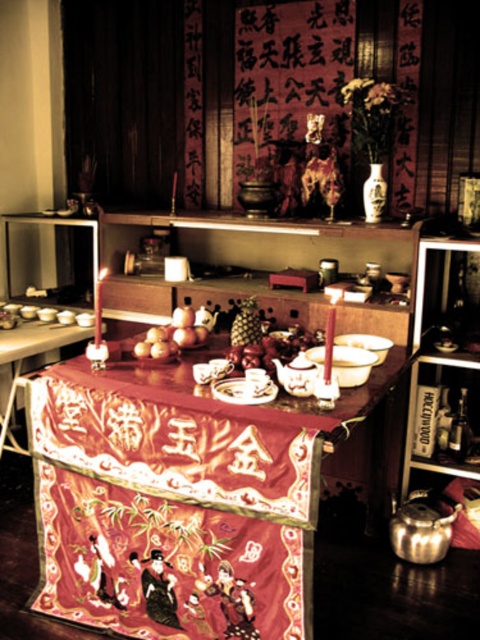
Does silky red tablecloth at center have a greater width compared to smooth golden apples at center?

Yes, silky red tablecloth at center is wider than smooth golden apples at center.

Is silky red tablecloth at center closer to the viewer compared to smooth golden apples at center?

Yes, it is in front of smooth golden apples at center.

Does point (149, 529) come behind point (186, 312)?

No, (149, 529) is in front of (186, 312).

Image resolution: width=480 pixels, height=640 pixels. Find the location of `silky red tablecloth at center`. silky red tablecloth at center is located at coordinates (172, 506).

Does shiny red apples at center have a lesser width compared to smooth golden apples at center?

Incorrect, shiny red apples at center's width is not less than smooth golden apples at center's.

Image resolution: width=480 pixels, height=640 pixels. Describe the element at coordinates (273, 348) in the screenshot. I see `shiny red apples at center` at that location.

Who is more forward, (x=312, y=333) or (x=163, y=348)?

Result: Point (x=163, y=348) is more forward.

This screenshot has width=480, height=640. What are the coordinates of `shiny red apples at center` in the screenshot? It's located at (273, 348).

Does silky red tablecloth at center appear under shiny red apples at center?

Correct, silky red tablecloth at center is located below shiny red apples at center.

Which of these two, silky red tablecloth at center or shiny red apples at center, stands taller?

silky red tablecloth at center is taller.

Locate an element on the screen. The height and width of the screenshot is (640, 480). silky red tablecloth at center is located at coordinates (172, 506).

This screenshot has height=640, width=480. What are the coordinates of `silky red tablecloth at center` in the screenshot? It's located at (172, 506).